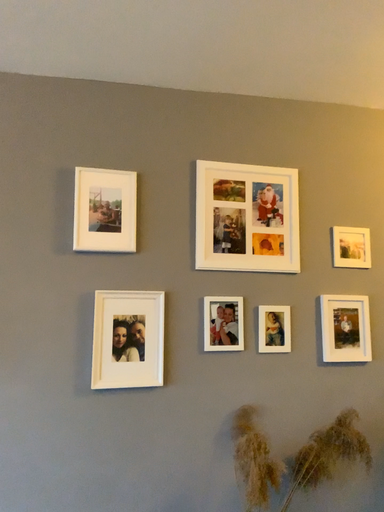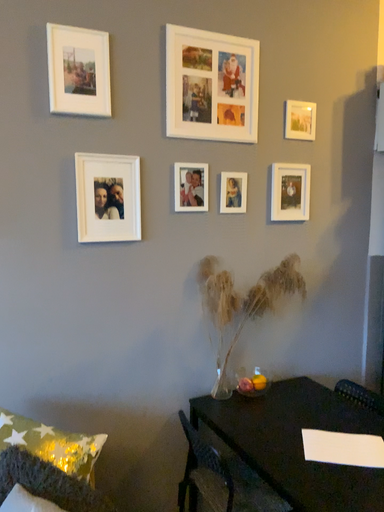
Question: How did the camera likely rotate when shooting the video?

Choices:
 (A) rotated right
 (B) rotated left

Answer: (A)